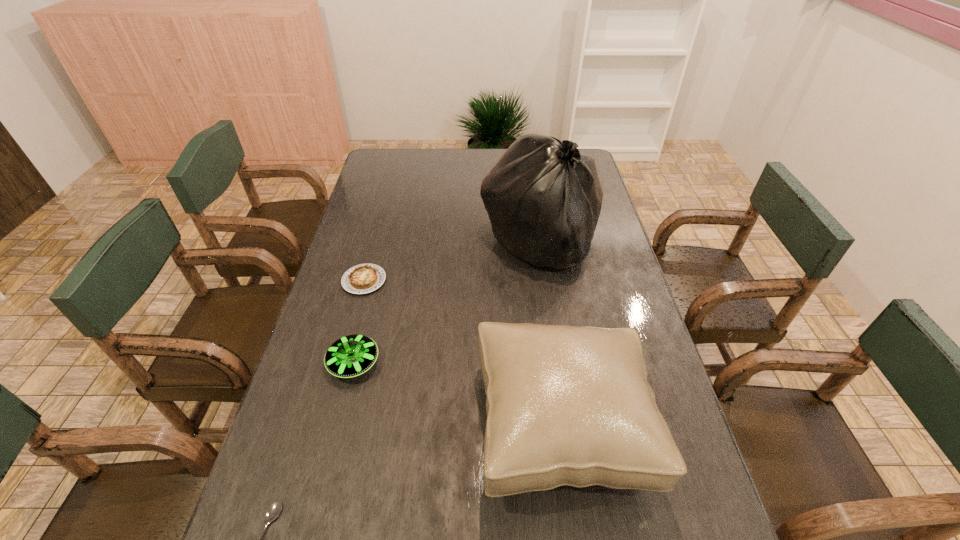
In order to click on plastic bag in this screenshot , I will do `click(543, 197)`.

Identify the location of the fourth shortest object. pyautogui.click(x=566, y=405).

Locate an element on the screen. This screenshot has width=960, height=540. saucer is located at coordinates (352, 355).

The image size is (960, 540). In order to click on the second shortest object in this screenshot , I will do `click(364, 278)`.

The width and height of the screenshot is (960, 540). I want to click on vacant space situated 0.070m on the front of the tallest object, so point(546,298).

Where is `vacant space located on the left of the cushion`? This screenshot has width=960, height=540. vacant space located on the left of the cushion is located at coordinates (332, 425).

Find the location of a particular element. Image resolution: width=960 pixels, height=540 pixels. free spot located 0.250m on the back of the saucer is located at coordinates (375, 277).

At what (x,y) coordinates should I click in order to perform the action: click on vacant space located on the front of the second shortest object. Please return your answer as a coordinate pair (x, y). Looking at the image, I should click on (339, 376).

Find the location of a particular element. The height and width of the screenshot is (540, 960). saucer situated at the left edge is located at coordinates (352, 355).

Find the location of a particular element. The width and height of the screenshot is (960, 540). quiche at the left edge is located at coordinates (364, 278).